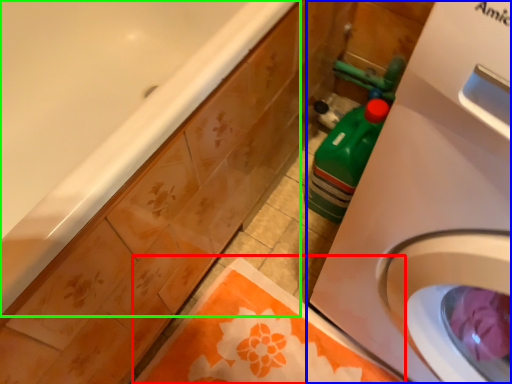
Question: Which object is positioned farthest from beach towel (highlighted by a red box)? Select from washing machine (highlighted by a blue box) and bathtub (highlighted by a green box).

Choices:
 (A) washing machine
 (B) bathtub

Answer: (B)